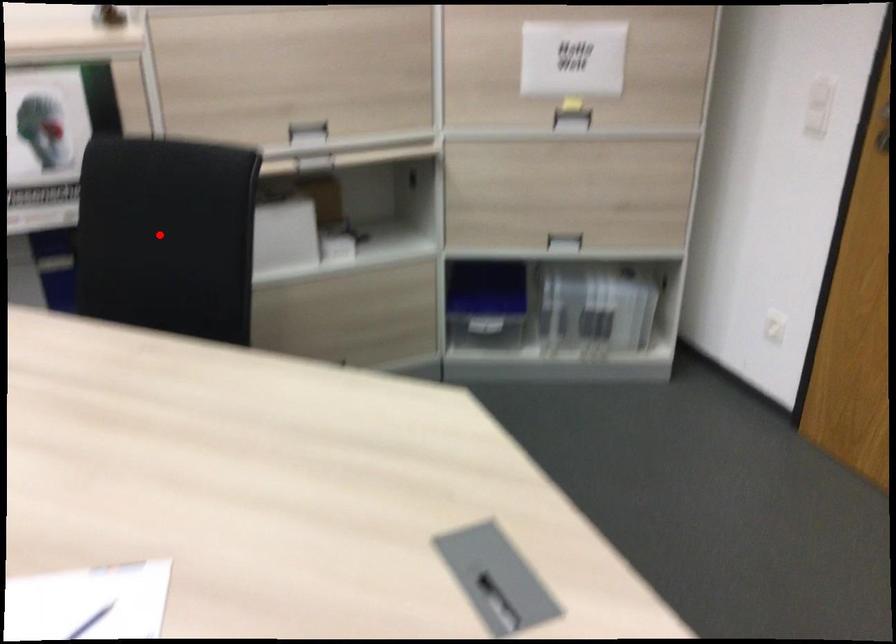
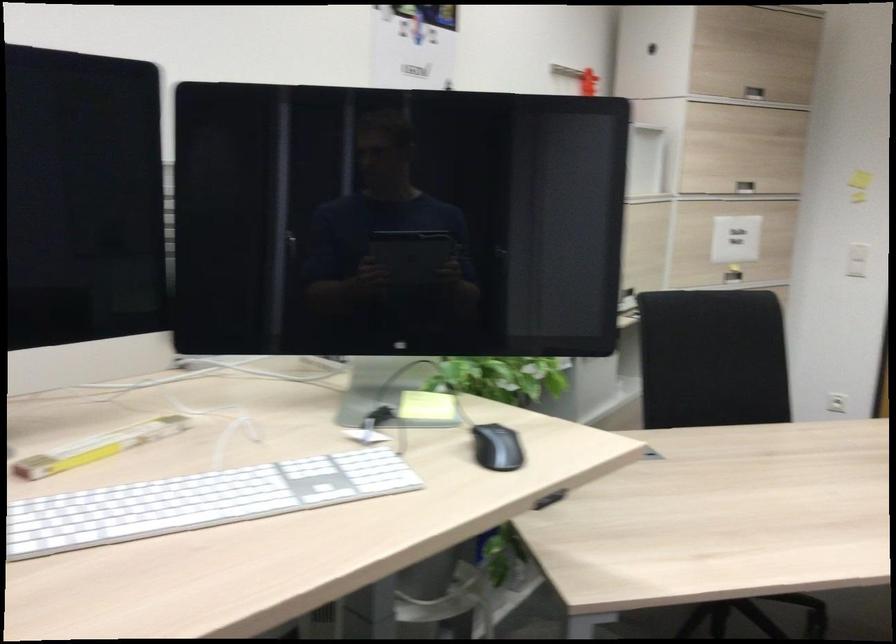
Question: I am providing you with two images of the same scene from different viewpoints. In image1, a red point is highlighted. Considering the same 3D point in image2, which of the following is correct?

Choices:
 (A) It is closer
 (B) It is farther

Answer: (B)